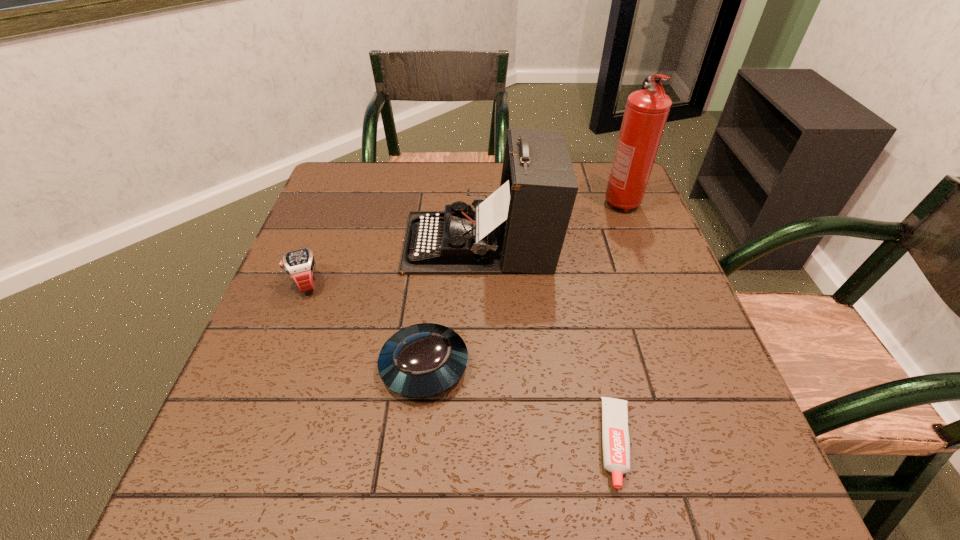
At what (x,y) coordinates should I click in order to perform the action: click on the rightmost object. Please return your answer as a coordinate pair (x, y). The height and width of the screenshot is (540, 960). Looking at the image, I should click on (646, 112).

Where is `fire extinguisher`? The image size is (960, 540). fire extinguisher is located at coordinates (646, 112).

The width and height of the screenshot is (960, 540). In order to click on typewriter in this screenshot , I will do `click(521, 227)`.

You are a GUI agent. You are given a task and a screenshot of the screen. Output one action in this format:
    pyautogui.click(x=<x>, y=<y>)
    Task: Click on the third shortest object
    Image resolution: width=960 pixels, height=540 pixels.
    Given the screenshot: What is the action you would take?
    pyautogui.click(x=299, y=264)

Locate an element on the screen. The width and height of the screenshot is (960, 540). the leftmost object is located at coordinates (299, 264).

The height and width of the screenshot is (540, 960). What are the coordinates of `the fourth tallest object` in the screenshot? It's located at (423, 360).

Find the location of a particular element. The height and width of the screenshot is (540, 960). the shortest object is located at coordinates (616, 445).

The height and width of the screenshot is (540, 960). I want to click on toothpaste, so click(616, 445).

Identify the location of free space located on the handle side the fire extinguisher. The image size is (960, 540). (647, 268).

This screenshot has width=960, height=540. Identify the location of free space located 0.210m inside the open case of the second tallest object. (321, 242).